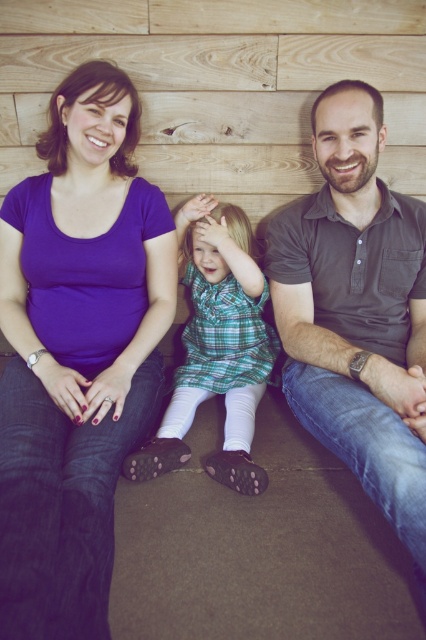
Question: Is purple matte t-shirt at left further to the viewer compared to dark gray polo shirt at right?

Choices:
 (A) yes
 (B) no

Answer: (B)

Question: Can you confirm if dark gray polo shirt at right is positioned below green plaid dress at center?

Choices:
 (A) yes
 (B) no

Answer: (B)

Question: Is purple matte t-shirt at left below dark gray polo shirt at right?

Choices:
 (A) yes
 (B) no

Answer: (A)

Question: Among these objects, which one is farthest from the camera?

Choices:
 (A) green plaid dress at center
 (B) dark gray polo shirt at right
 (C) purple matte t-shirt at left

Answer: (A)

Question: Estimate the real-world distances between objects in this image. Which object is farther from the dark gray polo shirt at right?

Choices:
 (A) purple matte t-shirt at left
 (B) green plaid dress at center

Answer: (A)

Question: Considering the real-world distances, which object is closest to the green plaid dress at center?

Choices:
 (A) dark gray polo shirt at right
 (B) purple matte t-shirt at left

Answer: (B)